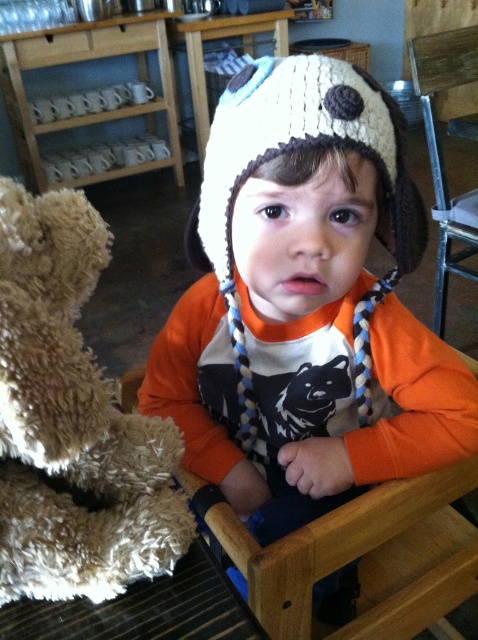
Question: Which object is closer to the camera taking this photo?

Choices:
 (A) fuzzy beige teddy bear at left
 (B) white knitted hat at center

Answer: (A)

Question: Is white knitted hat at center behind fuzzy beige teddy bear at left?

Choices:
 (A) yes
 (B) no

Answer: (A)

Question: Can you confirm if white knitted hat at center is positioned to the left of fuzzy beige teddy bear at left?

Choices:
 (A) no
 (B) yes

Answer: (A)

Question: Which point is closer to the camera?

Choices:
 (A) fuzzy beige teddy bear at left
 (B) white knitted hat at center

Answer: (A)

Question: Is white knitted hat at center wider than fuzzy beige teddy bear at left?

Choices:
 (A) no
 (B) yes

Answer: (B)